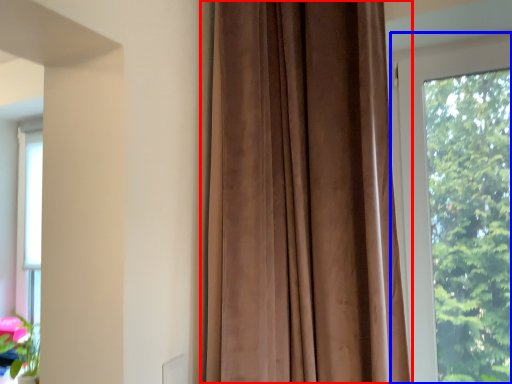
Question: Which of the following is the closest to the observer, curtain (highlighted by a red box) or window (highlighted by a blue box)?

Choices:
 (A) curtain
 (B) window

Answer: (A)